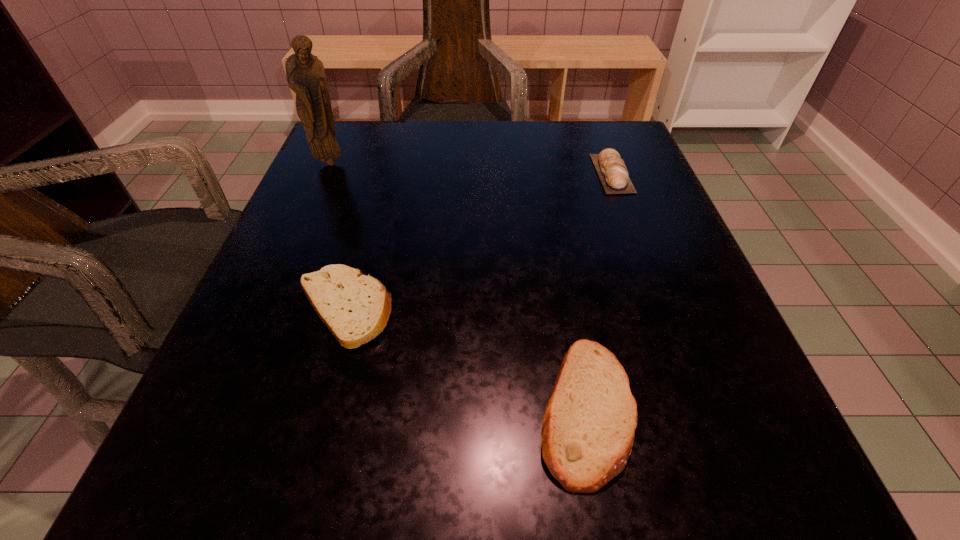
At what (x,y) coordinates should I click in order to perform the action: click on figurine. Please return your answer as a coordinate pair (x, y). The image size is (960, 540). Looking at the image, I should click on (305, 73).

I want to click on the leftmost object, so click(x=305, y=73).

The height and width of the screenshot is (540, 960). Identify the location of the farthest pita bread. (611, 169).

Where is `the rightmost pita bread`? the rightmost pita bread is located at coordinates (611, 169).

I want to click on the third object from left to right, so click(589, 424).

The height and width of the screenshot is (540, 960). Find the location of `the third object from right to left`. the third object from right to left is located at coordinates (356, 308).

Where is `the shortest object`? the shortest object is located at coordinates (356, 308).

Image resolution: width=960 pixels, height=540 pixels. Identify the location of vacant space positioned on the front-facing side of the tallest object. (315, 198).

Locate an element on the screen. The width and height of the screenshot is (960, 540). free space located 0.260m on the front of the farthest pita bread is located at coordinates (657, 293).

The height and width of the screenshot is (540, 960). In order to click on free spot located on the back of the second pita bread from right to left in this screenshot , I will do `click(548, 203)`.